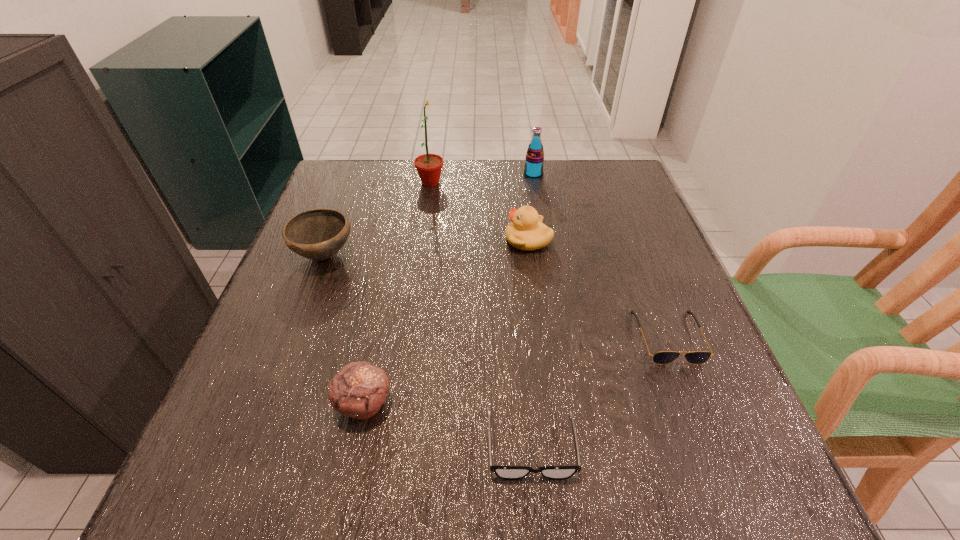
At what (x,y) coordinates should I click in order to perform the action: click on object that is at the right edge. Please return your answer as a coordinate pair (x, y). Looking at the image, I should click on (663, 357).

This screenshot has width=960, height=540. In the image, there is a desktop. Identify the location of vacant space at the left edge. (348, 214).

The image size is (960, 540). Find the location of `free space at the right edge`. free space at the right edge is located at coordinates click(x=604, y=213).

In the image, there is a desktop. At what (x,y) coordinates should I click in order to perform the action: click on vacant region at the far left corner. Please return your answer as a coordinate pair (x, y). Image resolution: width=960 pixels, height=540 pixels. Looking at the image, I should click on (371, 203).

What are the coordinates of `free space at the near left corner of the desktop` in the screenshot? It's located at (221, 475).

The height and width of the screenshot is (540, 960). In the image, there is a desktop. Identify the location of vacant space at the far right corner. (627, 168).

The width and height of the screenshot is (960, 540). What are the coordinates of `vacant space that is in between the fifth farthest object and the sixth shortest object` in the screenshot? It's located at (601, 255).

Where is `free space that is in between the tallest object and the soda`? The height and width of the screenshot is (540, 960). free space that is in between the tallest object and the soda is located at coordinates (482, 178).

The height and width of the screenshot is (540, 960). Find the location of `unoccupied position between the spectacles and the soda`. unoccupied position between the spectacles and the soda is located at coordinates (532, 310).

Where is `vacant area that lies between the duckling and the sunglasses`? The height and width of the screenshot is (540, 960). vacant area that lies between the duckling and the sunglasses is located at coordinates (598, 288).